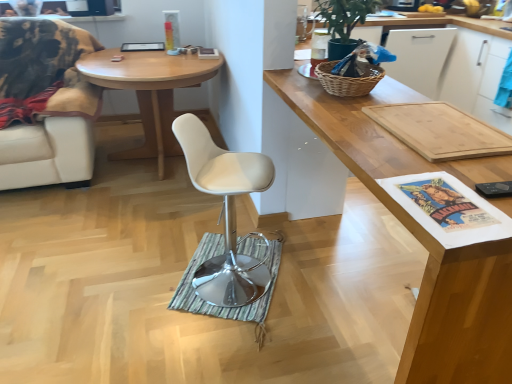
Find the location of a particular element. free space to the left of wooden cutting board at upper right is located at coordinates (168, 293).